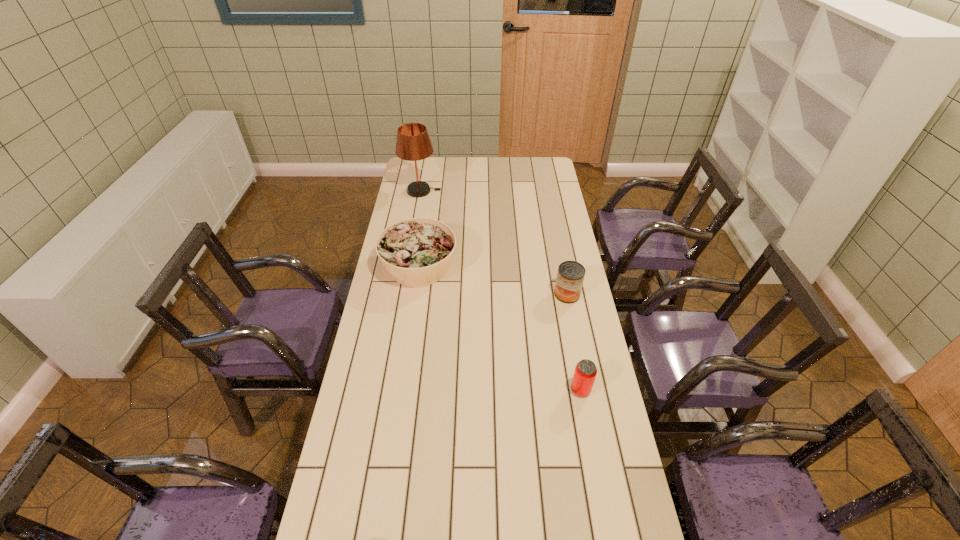
Select which object appears as the second closest to the salad. Please provide its 2D coordinates. Your answer should be formatted as a tuple, i.e. [(x, y)], where the tuple contains the x and y coordinates of a point satisfying the conditions above.

[(570, 276)]

What are the coordinates of `the second closest object to the nearer can` in the screenshot? It's located at (417, 252).

Locate which can is the second closest to the salad. Please provide its 2D coordinates. Your answer should be formatted as a tuple, i.e. [(x, y)], where the tuple contains the x and y coordinates of a point satisfying the conditions above.

[(585, 372)]

I want to click on can identified as the second closest to the salad, so click(x=585, y=372).

This screenshot has width=960, height=540. I want to click on free spot that satisfies the following two spatial constraints: 1. on the back side of the nearest object; 2. on the right side of the farther can, so click(563, 294).

This screenshot has height=540, width=960. In order to click on blank area in the image that satisfies the following two spatial constraints: 1. on the front-facing side of the tallest object; 2. on the right side of the salad in this screenshot , I will do `click(408, 267)`.

You are a GUI agent. You are given a task and a screenshot of the screen. Output one action in this format:
    pyautogui.click(x=<x>, y=<y>)
    Task: Click on the free location that satisfies the following two spatial constraints: 1. on the front-facing side of the lampshade; 2. on the left side of the nearest object
    The image size is (960, 540).
    Given the screenshot: What is the action you would take?
    pyautogui.click(x=386, y=390)

Locate an element on the screen. This screenshot has width=960, height=540. free spot that satisfies the following two spatial constraints: 1. on the back side of the salad; 2. on the front-facing side of the farthest object is located at coordinates (430, 191).

Identify the location of free space that satisfies the following two spatial constraints: 1. on the front-facing side of the lampshade; 2. on the back side of the farther can. The image size is (960, 540). (403, 294).

Find the location of a particular element. Image resolution: width=960 pixels, height=540 pixels. vacant space that satisfies the following two spatial constraints: 1. on the front-facing side of the nearest object; 2. on the left side of the farthest object is located at coordinates click(x=386, y=390).